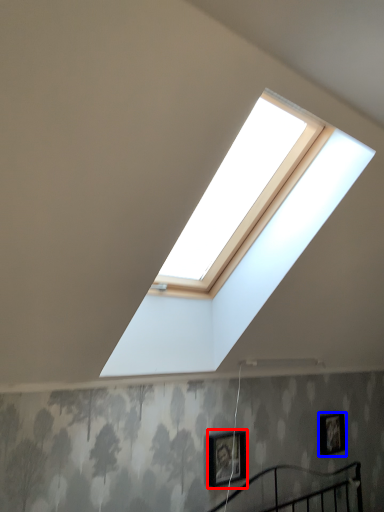
Question: Which point is closer to the camera, picture frame (highlighted by a red box) or picture frame (highlighted by a blue box)?

Choices:
 (A) picture frame
 (B) picture frame

Answer: (A)